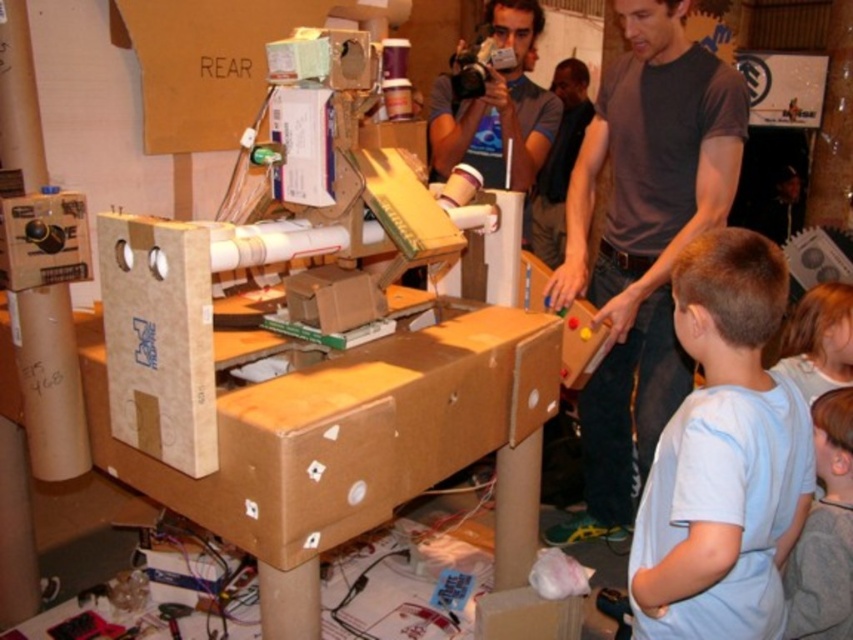
You are standing in front of the cardboard structure and want to locate the matte blue shirt at upper center. Where exactly should you look on the structure?

You should look at point coordinates of (x=498, y=108) on the structure to find the matte blue shirt at upper center.

You are an observer looking at the cardboard structure. You notice two features near the top of the structure. One is the matte blue shirt at upper center and the other is the light brown hair at upper right. Which of these two features is bigger in size?

The matte blue shirt at upper center has a larger size compared to the light brown hair at upper right.